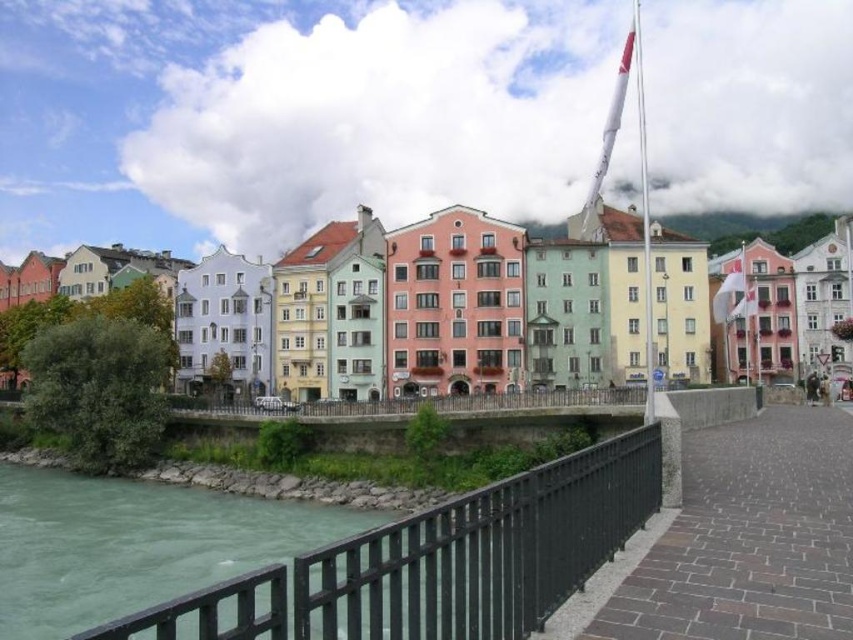
Question: Is black metal railing at lower center wider than white fabric flag at upper right?

Choices:
 (A) yes
 (B) no

Answer: (A)

Question: Which of the following is the farthest from the observer?

Choices:
 (A) black metal railing at lower center
 (B) green stone river at lower left

Answer: (B)

Question: Which of the following is the closest to the observer?

Choices:
 (A) (107, 612)
 (B) (605, 132)
 (C) (300, 579)

Answer: (C)

Question: Is black metal railing at lower center closer to the viewer compared to pastel painted buildings at center?

Choices:
 (A) yes
 (B) no

Answer: (A)

Question: Considering the real-world distances, which object is closest to the white fabric flag at upper right?

Choices:
 (A) green stone river at lower left
 (B) pastel painted buildings at center

Answer: (B)

Question: Is the position of black metal railing at lower center more distant than that of green stone river at lower left?

Choices:
 (A) yes
 (B) no

Answer: (B)